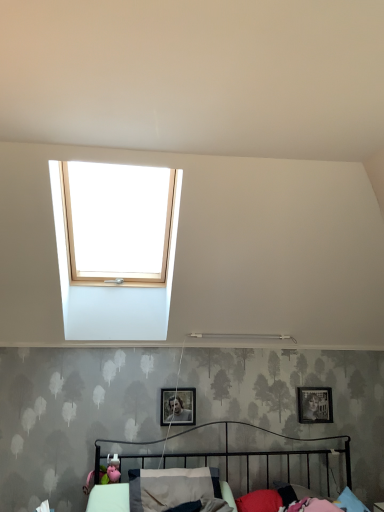
Question: Does metallic silver picture frame at center, marked as the first picture frame in a left-to-right arrangement, turn towards red fabric pillow at lower center, the 1th pillow viewed from the right?

Choices:
 (A) no
 (B) yes

Answer: (A)

Question: Can you confirm if metallic silver picture frame at center, the 1th picture frame viewed from the front, is positioned to the left of red fabric pillow at lower center, the second pillow viewed from the left?

Choices:
 (A) no
 (B) yes

Answer: (B)

Question: Is metallic silver picture frame at center, the 1th picture frame viewed from the front, not within red fabric pillow at lower center, the 1th pillow viewed from the right?

Choices:
 (A) yes
 (B) no

Answer: (A)

Question: Would you consider metallic silver picture frame at center, the second picture frame from the right, to be distant from red fabric pillow at lower center, the second pillow viewed from the left?

Choices:
 (A) yes
 (B) no

Answer: (B)

Question: Considering the relative sizes of metallic silver picture frame at center, the second picture frame from the right, and red fabric pillow at lower center, the 1th pillow viewed from the right, in the image provided, is metallic silver picture frame at center, the second picture frame from the right, smaller than red fabric pillow at lower center, the 1th pillow viewed from the right,?

Choices:
 (A) yes
 (B) no

Answer: (A)

Question: Is metallic silver picture frame at center, arranged as the 2th picture frame when viewed from the back, in contact with red fabric pillow at lower center, the second pillow viewed from the left?

Choices:
 (A) no
 (B) yes

Answer: (A)

Question: Does gray fabric pillow at lower center, arranged as the 1th pillow when viewed from the left, lie in front of metallic silver picture frame at center, the second picture frame from the right?

Choices:
 (A) yes
 (B) no

Answer: (A)

Question: Considering the relative sizes of gray fabric pillow at lower center, the second pillow in the right-to-left sequence, and metallic silver picture frame at center, arranged as the 2th picture frame when viewed from the back, in the image provided, is gray fabric pillow at lower center, the second pillow in the right-to-left sequence, bigger than metallic silver picture frame at center, arranged as the 2th picture frame when viewed from the back,?

Choices:
 (A) no
 (B) yes

Answer: (B)

Question: Is gray fabric pillow at lower center, the second pillow in the right-to-left sequence, to the left of metallic silver picture frame at center, the second picture frame from the right, from the viewer's perspective?

Choices:
 (A) no
 (B) yes

Answer: (A)

Question: Considering the relative sizes of gray fabric pillow at lower center, arranged as the 1th pillow when viewed from the left, and metallic silver picture frame at center, the 1th picture frame viewed from the front, in the image provided, is gray fabric pillow at lower center, arranged as the 1th pillow when viewed from the left, shorter than metallic silver picture frame at center, the 1th picture frame viewed from the front,?

Choices:
 (A) yes
 (B) no

Answer: (B)

Question: Is gray fabric pillow at lower center, the second pillow in the right-to-left sequence, further to camera compared to metallic silver picture frame at center, the 1th picture frame viewed from the front?

Choices:
 (A) no
 (B) yes

Answer: (A)

Question: From the image's perspective, is gray fabric pillow at lower center, the second pillow in the right-to-left sequence, beneath metallic silver picture frame at center, the 1th picture frame viewed from the front?

Choices:
 (A) no
 (B) yes

Answer: (B)

Question: Does matte black picture frame at upper right, marked as the 2th picture frame in a left-to-right arrangement, turn towards metallic black bed at lower center?

Choices:
 (A) no
 (B) yes

Answer: (A)